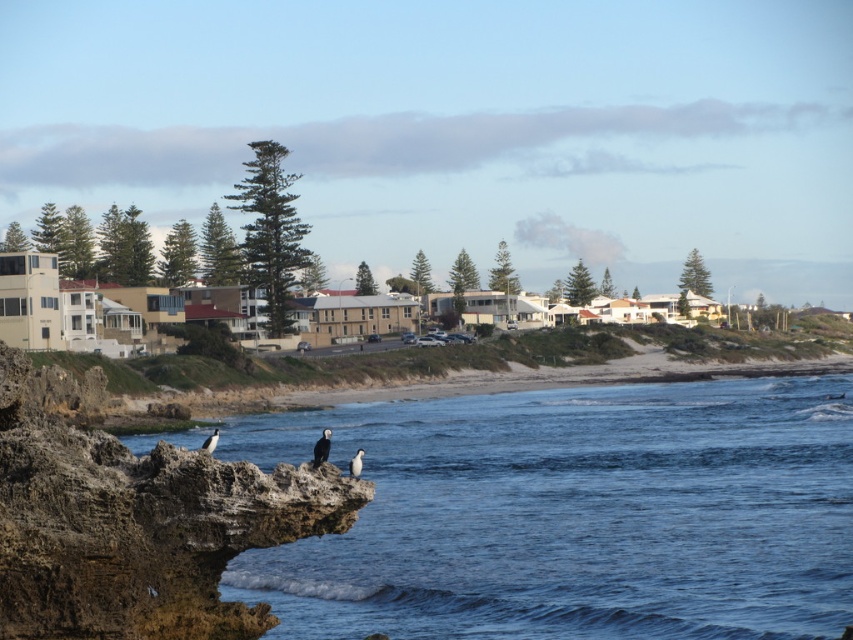
You are a photographer standing on the beach and want to take a photo of the white feathered bird at lower left without the brown rocky cliff at lower left blocking the view. Is it possible to do so?

The brown rocky cliff at lower left is positioned over the white feathered bird at lower left, so the cliff will block the view of the bird. You cannot take a photo of the white feathered bird at lower left without the cliff blocking it.

You are standing on the beach and see the brown rocky cliff at lower left and the black feathered bird at lower left. Which object is positioned more to the left side?

The brown rocky cliff at lower left is positioned to the left of the black feathered bird at lower left, so the brown rocky cliff at lower left is more to the left.